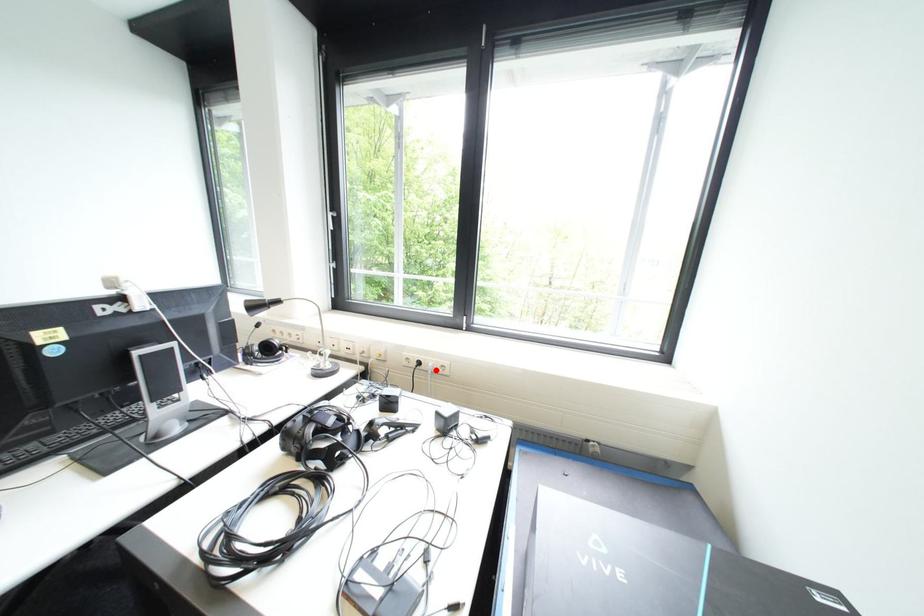
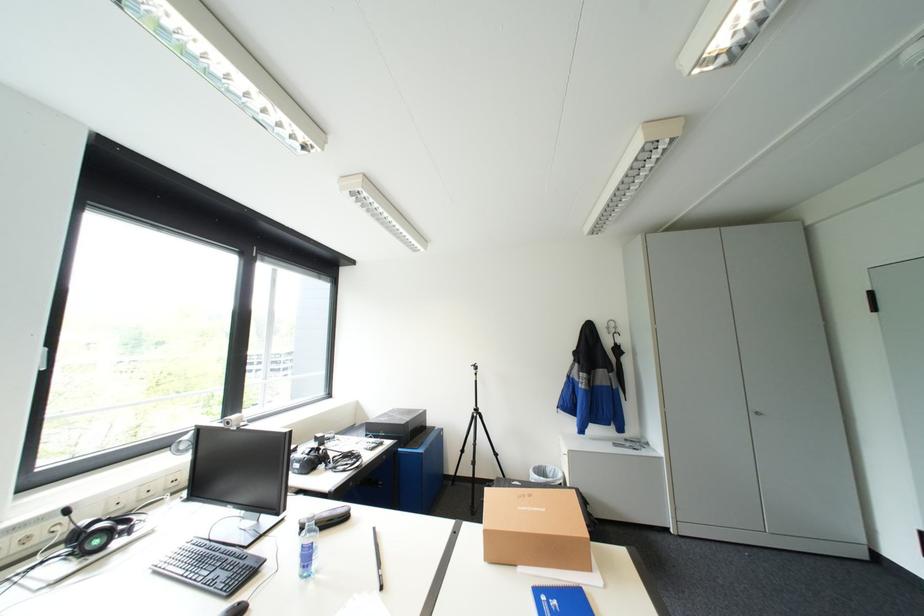
Question: I am providing you with two images of the same scene from different viewpoints. A red point is marked on the first image. Is the red point's position out of view in image 2?

Choices:
 (A) Yes
 (B) No

Answer: (A)